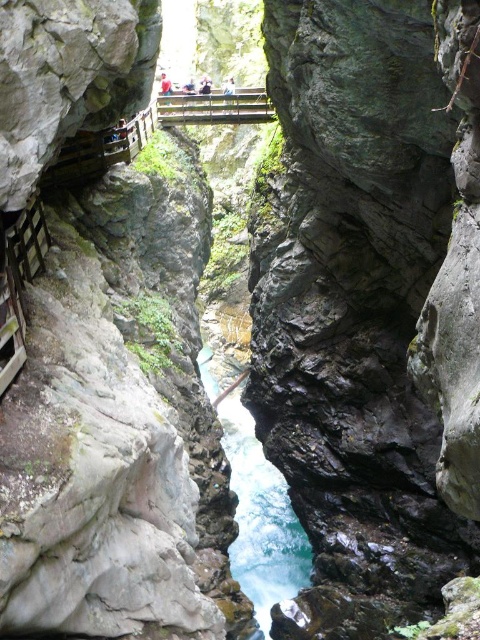
Is blue translucent water at center wider than wooden at center?

Yes, blue translucent water at center is wider than wooden at center.

How far apart are blue translucent water at center and wooden at center?

They are 10.16 meters apart.

Where is `blue translucent water at center`? blue translucent water at center is located at coordinates (262, 518).